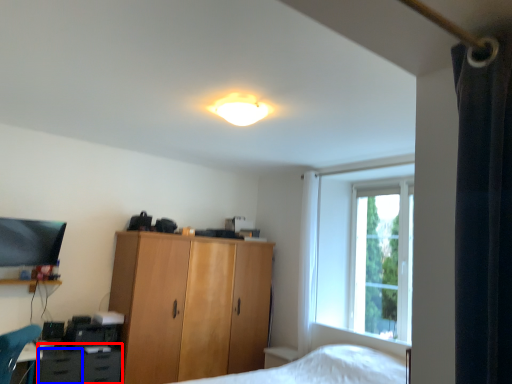
Question: Which object appears farthest to the camera in this image, cabinetry (highlighted by a red box) or drawer (highlighted by a blue box)?

Choices:
 (A) cabinetry
 (B) drawer

Answer: (A)